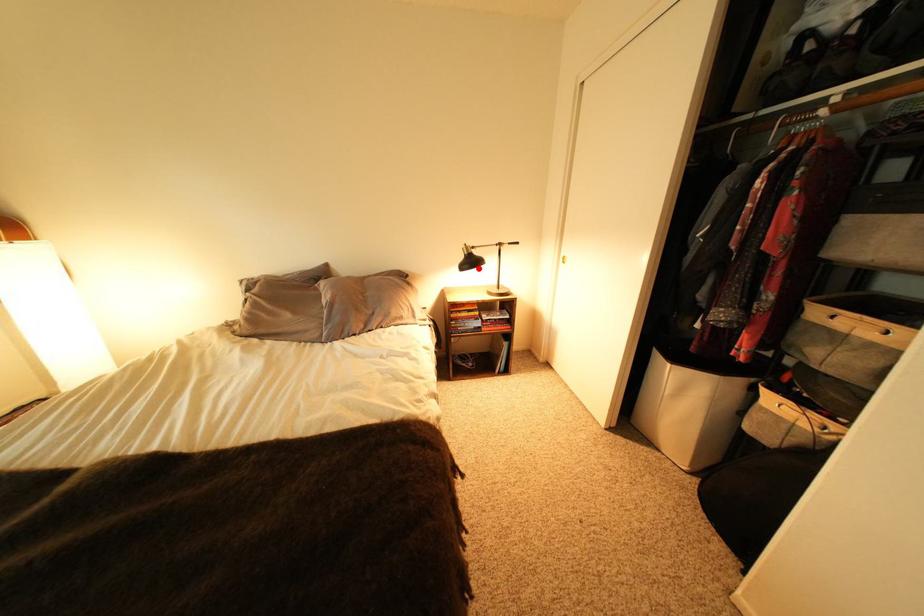
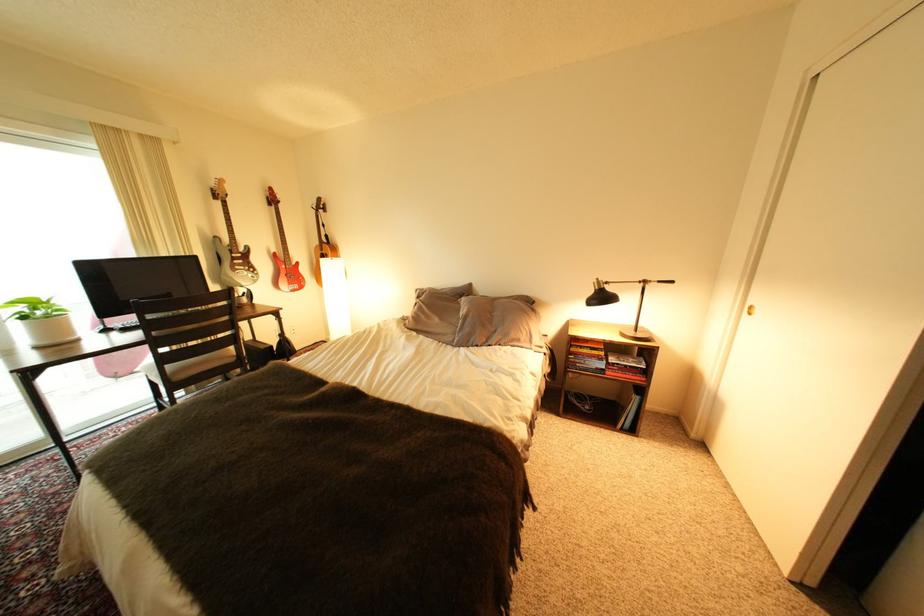
Where in the second image is the point corresponding to the highlighted location from the first image?

(608, 304)